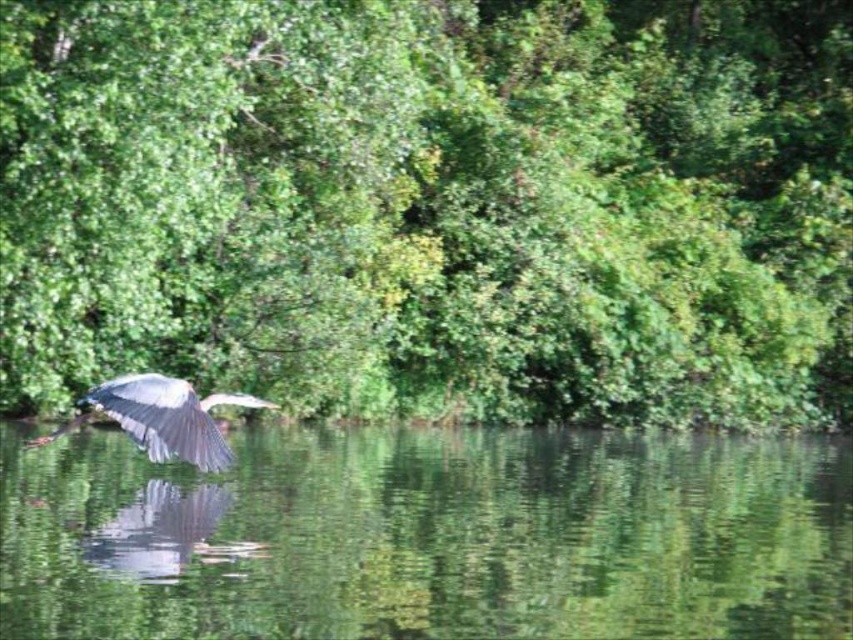
Does point (544, 241) come behind point (161, 616)?

Yes, point (544, 241) is farther from viewer.

Who is taller, green leafy trees at upper center or green reflective water at center?

Standing taller between the two is green leafy trees at upper center.

Where is `green leafy trees at upper center`? The height and width of the screenshot is (640, 853). green leafy trees at upper center is located at coordinates (433, 205).

Is point (117, 518) farther from camera compared to point (164, 432)?

Yes, it is.

You are a GUI agent. You are given a task and a screenshot of the screen. Output one action in this format:
    pyautogui.click(x=<x>, y=<y>)
    Task: Click on the green reflective water at center
    The image size is (853, 640).
    Given the screenshot: What is the action you would take?
    pyautogui.click(x=428, y=536)

Can you confirm if green leafy trees at upper center is thinner than gray feathered bird at left?

In fact, green leafy trees at upper center might be wider than gray feathered bird at left.

This screenshot has height=640, width=853. I want to click on green leafy trees at upper center, so click(433, 205).

Locate an element on the screen. Image resolution: width=853 pixels, height=640 pixels. green leafy trees at upper center is located at coordinates (433, 205).